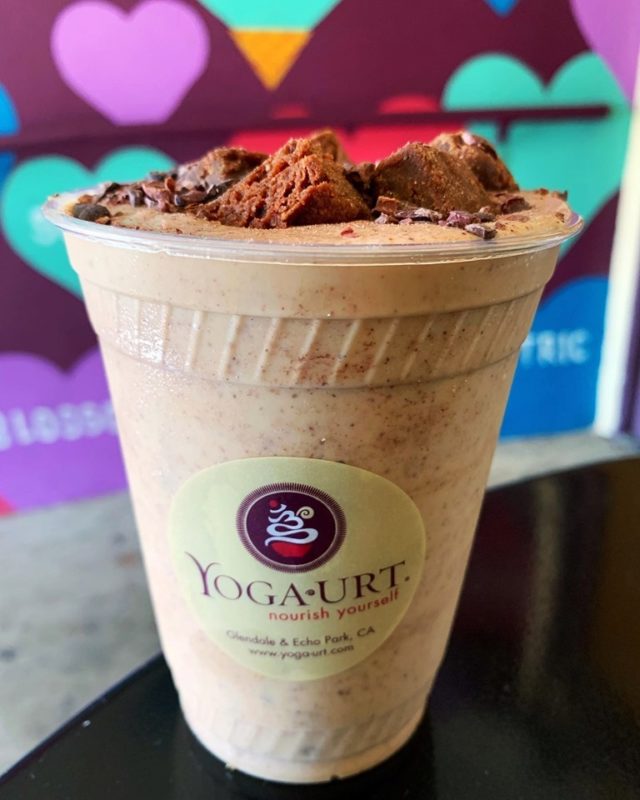
What are the coordinates of `table` in the screenshot? It's located at (498, 705).